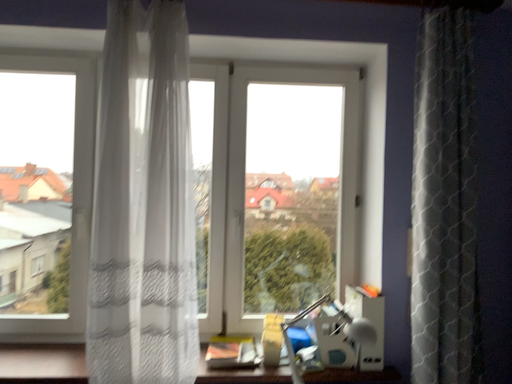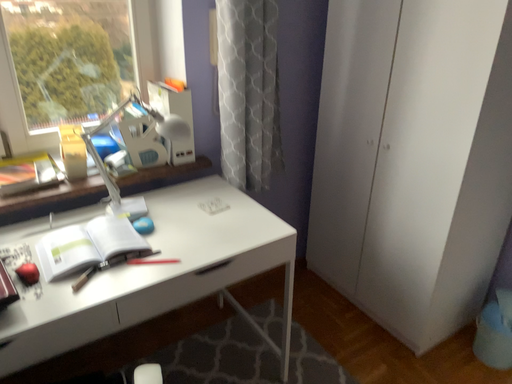
Question: How did the camera likely rotate when shooting the video?

Choices:
 (A) rotated downward
 (B) rotated upward

Answer: (A)